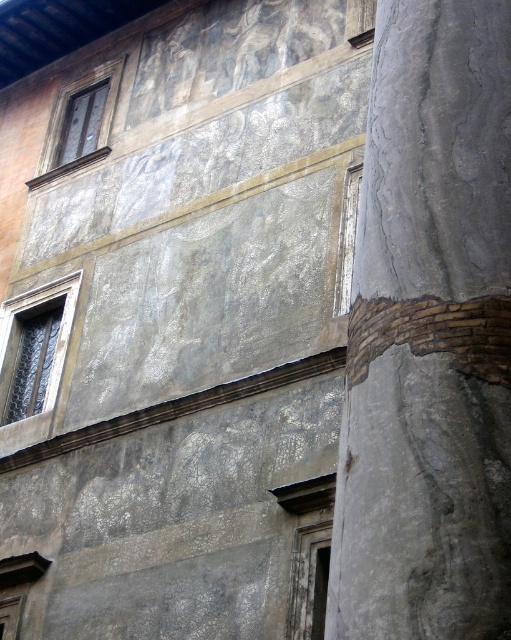
You are an architect examining the old building. You need to place a new decorative element exactly at the center of the gray stone column at right. What are the coordinates where you should place it?

The gray stone column at right is located at point (429,337), so you should place the decorative element at those coordinates to center it on the column.

You are an architect assessing the structural integrity of this old building. You notice the gray stone column at right and the wooden window frame at upper left. Which of these two objects has a smaller diameter or width?

The gray stone column at right is thinner than the wooden window frame at upper left, so the gray stone column at right has a smaller diameter or width.

You are an architect examining the old building. You notice the gray stone column at right. Based on its position, can you determine if it is closer to the bottom or the top of the wall?

The gray stone column at right is located at point coordinates approximately 0.527 along the horizontal axis and 0.841 along the vertical axis. Since the vertical coordinate is closer to 1, which typically represents the top of the image, the column is positioned closer to the top of the wall.